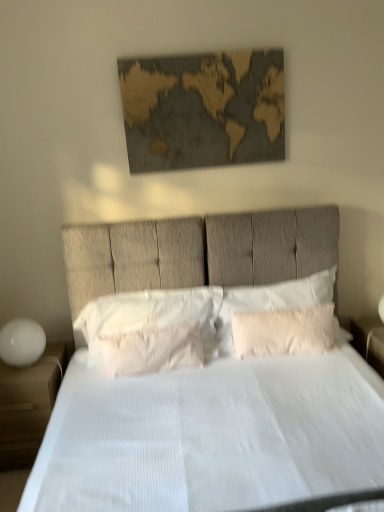
This screenshot has width=384, height=512. In order to click on blank space situated above gold textured map at upper center (from a real-world perspective) in this screenshot , I will do `click(195, 51)`.